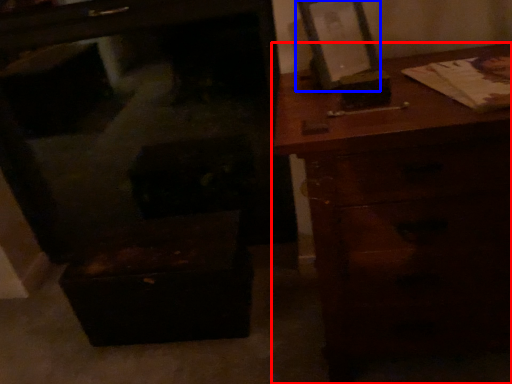
Question: Which object is further to the camera taking this photo, chest of drawers (highlighted by a red box) or picture frame (highlighted by a blue box)?

Choices:
 (A) chest of drawers
 (B) picture frame

Answer: (B)